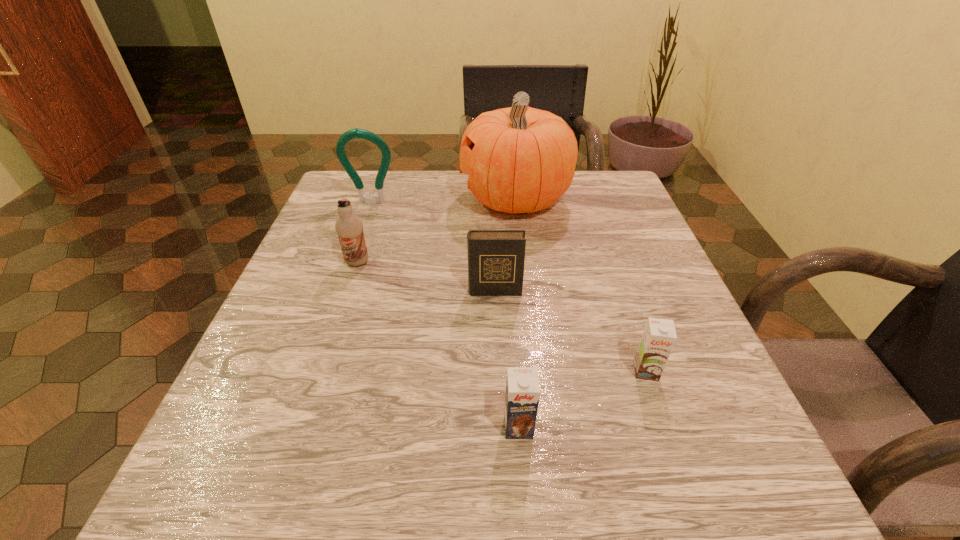
The image size is (960, 540). I want to click on the tallest object, so click(x=519, y=159).

Where is `bottle opener`? bottle opener is located at coordinates (357, 133).

I want to click on the fourth nearest object, so click(x=349, y=227).

You are a GUI agent. You are given a task and a screenshot of the screen. Output one action in this format:
    pyautogui.click(x=<x>, y=<y>)
    Task: Click on the leftmost chocolate milk
    
    Given the screenshot: What is the action you would take?
    pyautogui.click(x=349, y=227)

At what (x,y) coordinates should I click in order to perform the action: click on diary. Please return your answer as a coordinate pair (x, y). Image resolution: width=960 pixels, height=540 pixels. Looking at the image, I should click on (496, 258).

This screenshot has width=960, height=540. I want to click on the nearest object, so click(522, 387).

At what (x,y) coordinates should I click in order to perform the action: click on the second chocolate milk from right to left. Please return your answer as a coordinate pair (x, y). The image size is (960, 540). Looking at the image, I should click on (522, 387).

What are the coordinates of `the rightmost chocolate milk` in the screenshot? It's located at (659, 336).

Identify the location of the fifth farthest object. This screenshot has height=540, width=960. (659, 336).

At what (x,y) coordinates should I click in order to perform the action: click on vacant region located 0.080m on the front-facing side of the pumpkin. Please return your answer as a coordinate pair (x, y). This screenshot has height=540, width=960. Looking at the image, I should click on (427, 199).